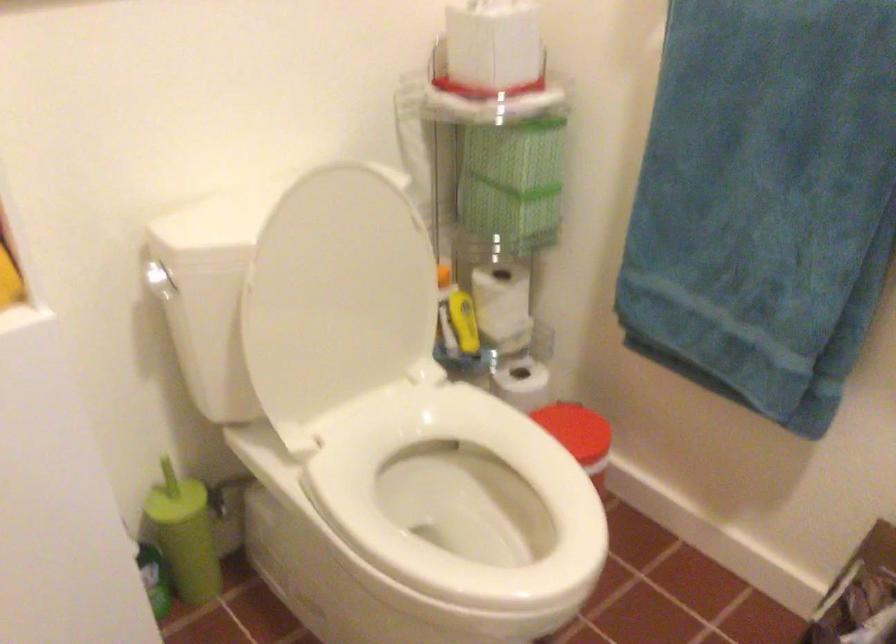
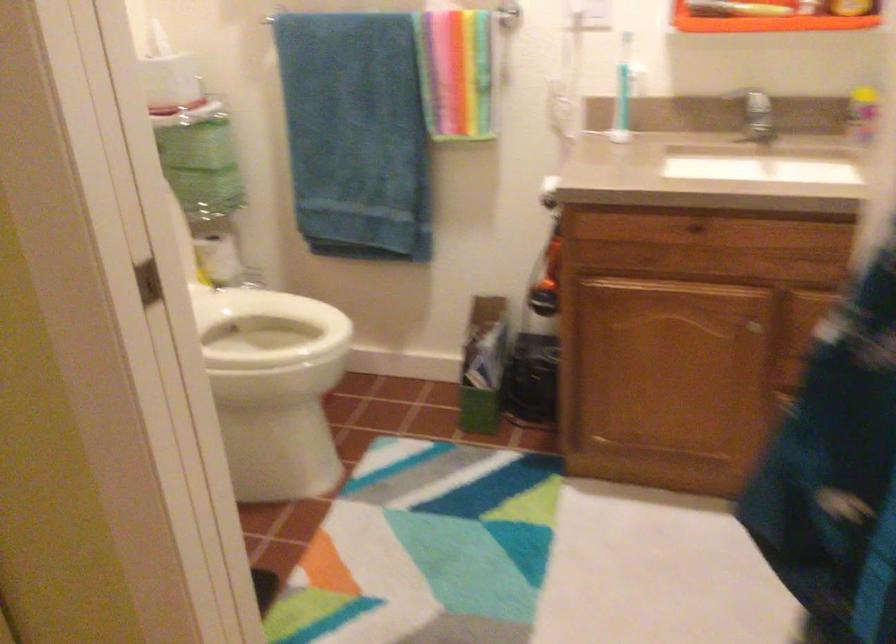
Where in the second image is the point corresponding to point (504, 460) from the first image?

(265, 328)